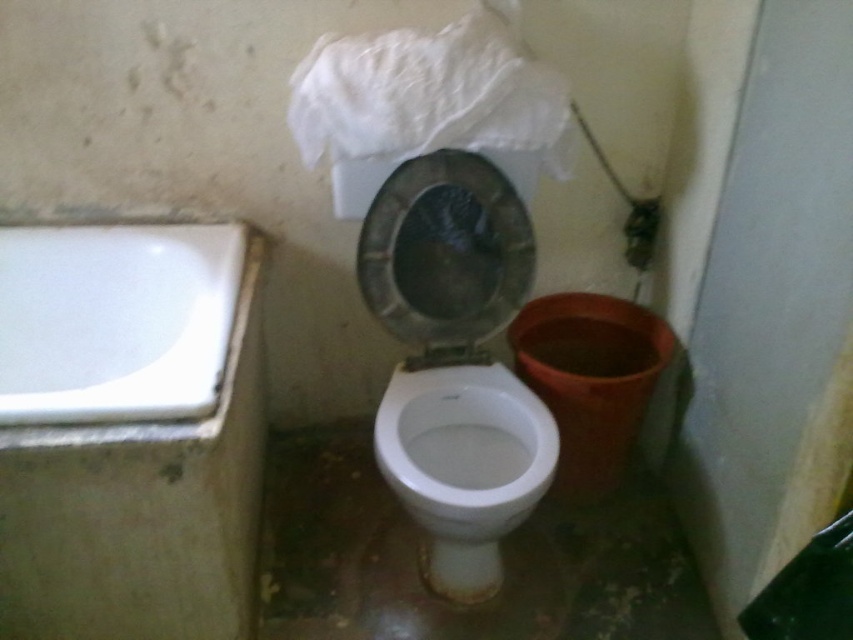
Question: Which point appears farthest from the camera in this image?

Choices:
 (A) (437, 376)
 (B) (392, 131)

Answer: (A)

Question: Is white glossy bathtub at left to the right of white crumpled paper at upper center from the viewer's perspective?

Choices:
 (A) yes
 (B) no

Answer: (B)

Question: Among these objects, which one is nearest to the camera?

Choices:
 (A) white glossy toilet bowl at center
 (B) white glossy bathtub at left

Answer: (B)

Question: From the image, what is the correct spatial relationship of white glossy bathtub at left in relation to white glossy toilet bowl at center?

Choices:
 (A) left
 (B) right

Answer: (A)

Question: Is white crumpled paper at upper center above white glossy toilet bowl at center?

Choices:
 (A) yes
 (B) no

Answer: (A)

Question: Which point appears farthest from the camera in this image?

Choices:
 (A) (518, 484)
 (B) (408, 68)

Answer: (B)